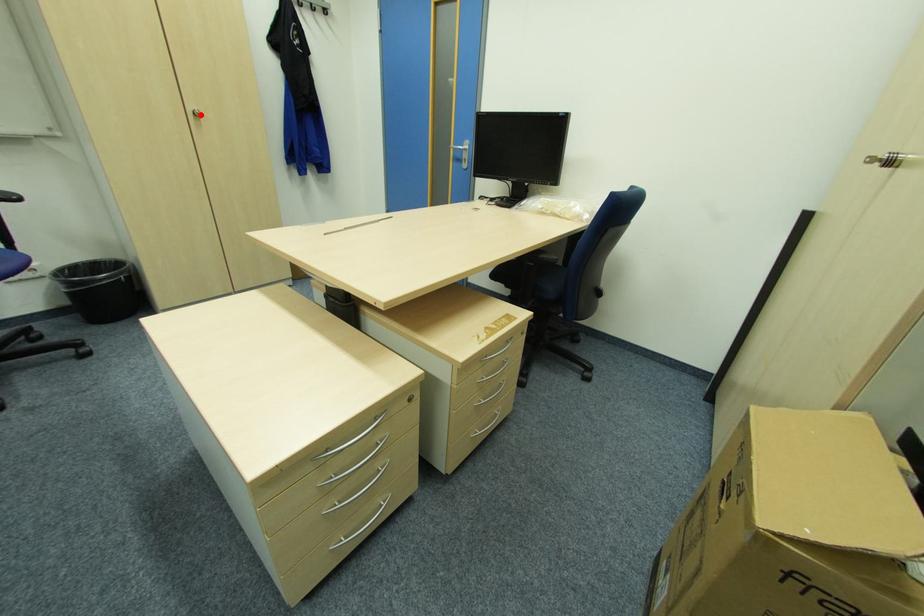
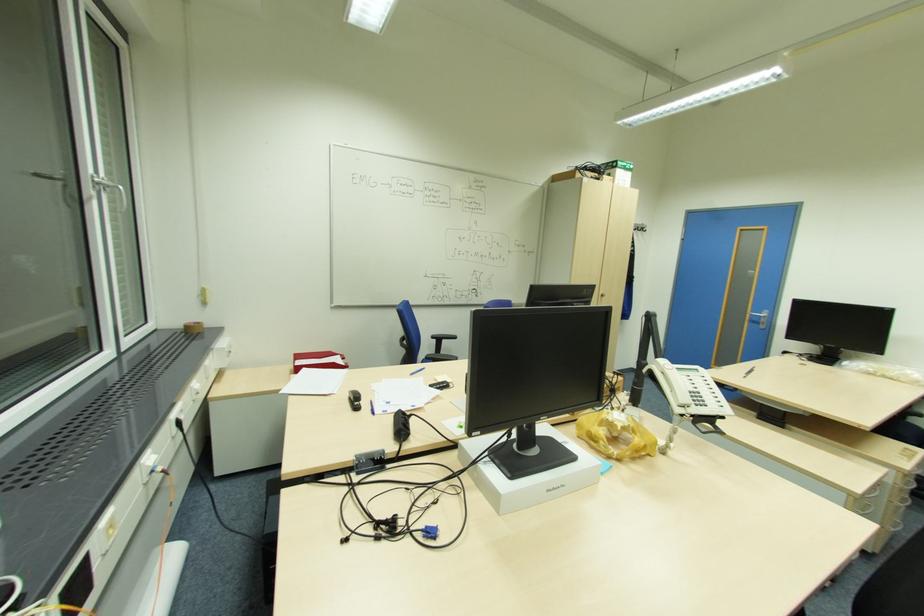
Locate, in the second image, the point that corresponds to the highlighted location in the first image.

(604, 294)